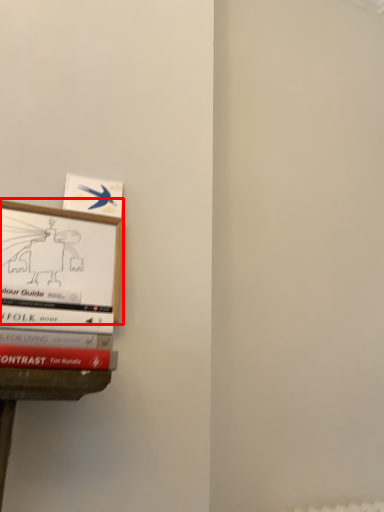
Question: From the image's perspective, what is the correct spatial relationship of picture frame (annotated by the red box) in relation to book?

Choices:
 (A) below
 (B) above

Answer: (A)